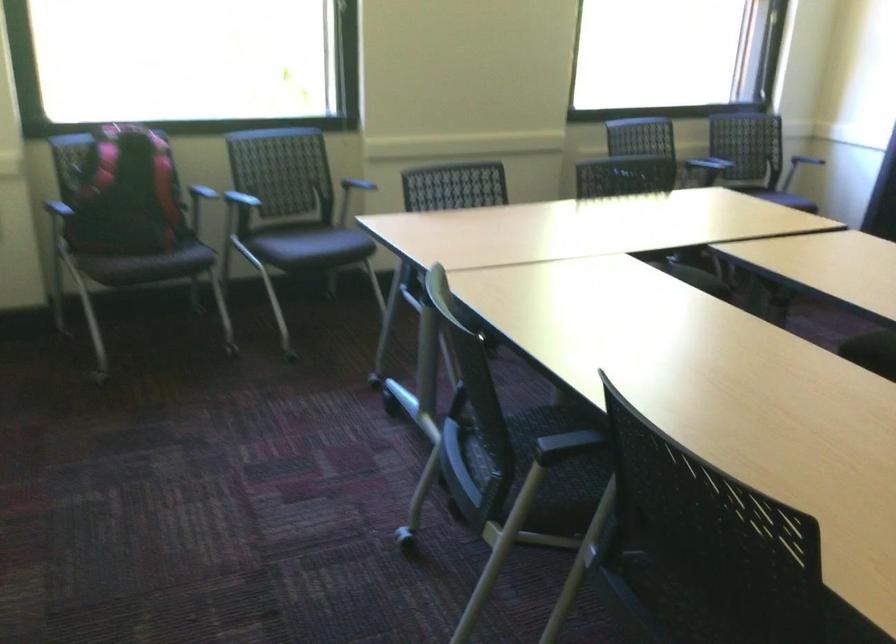
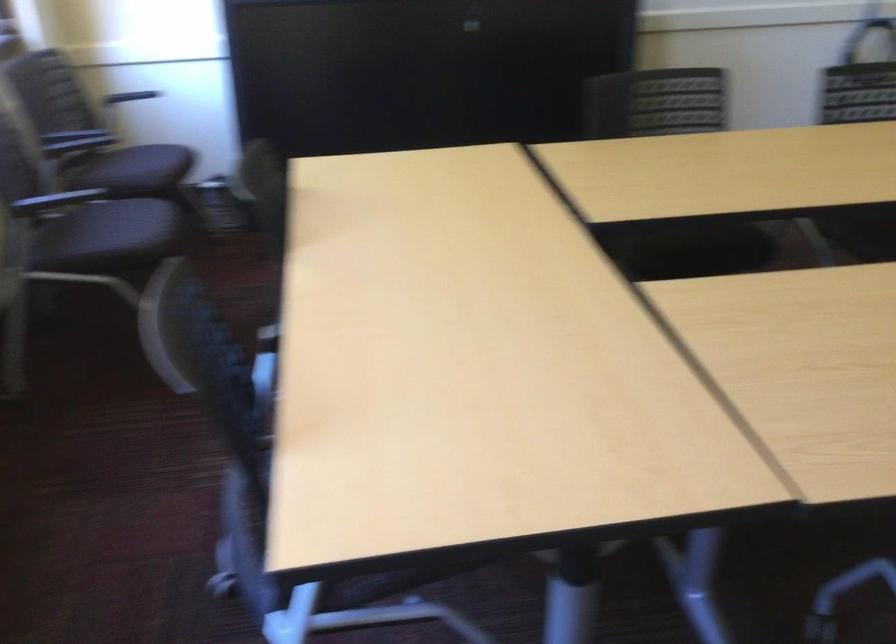
Locate, in the second image, the point that corresponds to pixel 743 190 in the first image.

(135, 169)